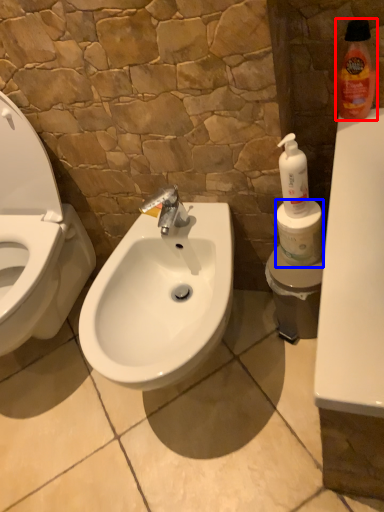
Question: Among these objects, which one is farthest to the camera, cleaning product (highlighted by a red box) or toilet paper (highlighted by a blue box)?

Choices:
 (A) cleaning product
 (B) toilet paper

Answer: (B)